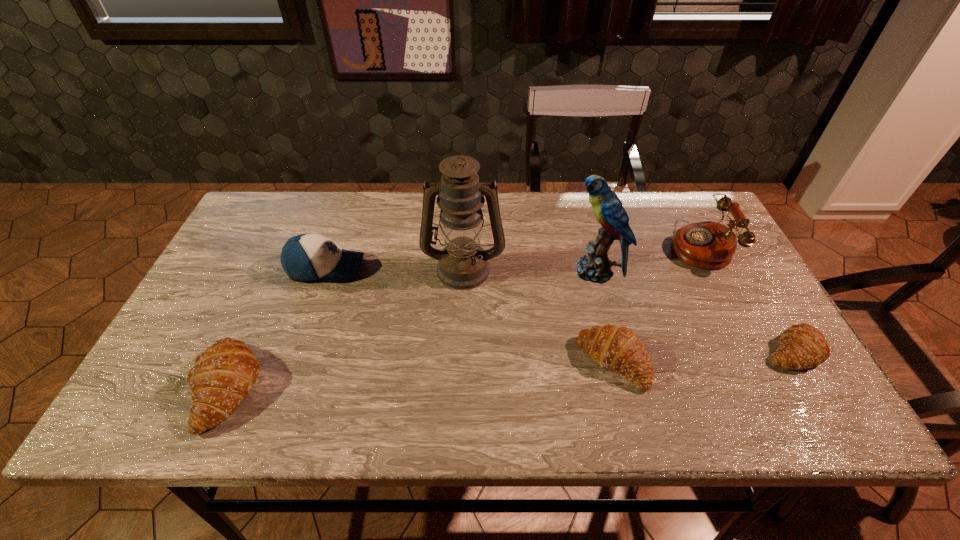
Image resolution: width=960 pixels, height=540 pixels. I want to click on free point between the leftmost crescent roll and the baseball cap, so 276,328.

Identify the location of free space between the fifth object from right to left and the leftmost crescent roll. (345, 328).

Locate an element on the screen. This screenshot has width=960, height=540. free space between the shortest crescent roll and the fourth shortest object is located at coordinates (559, 309).

Locate an element on the screen. The height and width of the screenshot is (540, 960). object identified as the third closest to the leftmost crescent roll is located at coordinates (615, 348).

Where is `the sixth closest object to the leftmost crescent roll`? The width and height of the screenshot is (960, 540). the sixth closest object to the leftmost crescent roll is located at coordinates (802, 346).

You are a GUI agent. You are given a task and a screenshot of the screen. Output one action in this format:
    pyautogui.click(x=<x>, y=<y>)
    Task: Click on the crescent roll that stands as the third closest to the third tallest object
    The height and width of the screenshot is (540, 960).
    Given the screenshot: What is the action you would take?
    pyautogui.click(x=222, y=376)

This screenshot has height=540, width=960. I want to click on crescent roll that is the second closest to the sixth shortest object, so click(802, 346).

Find the location of a particular element. This screenshot has width=960, height=540. free space that satisfies the following two spatial constraints: 1. on the front-facing side of the baseball cap; 2. on the left side of the third object from left to right is located at coordinates (325, 268).

Where is `free space that satisfies the following two spatial constraints: 1. on the front-facing side of the fourth shortest object; 2. on the left side of the second tallest crescent roll`? free space that satisfies the following two spatial constraints: 1. on the front-facing side of the fourth shortest object; 2. on the left side of the second tallest crescent roll is located at coordinates (294, 362).

Find the location of a particular element. The image size is (960, 540). free location that satisfies the following two spatial constraints: 1. on the back side of the second crescent roll from right to left; 2. on the front-facing side of the baseball cap is located at coordinates (589, 268).